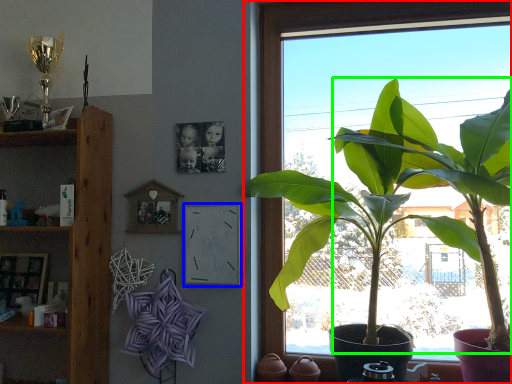
Question: Which object is the farthest from window (highlighted by a red box)? Choose among these: picture frame (highlighted by a blue box) or banana tree (highlighted by a green box).

Choices:
 (A) picture frame
 (B) banana tree

Answer: (B)